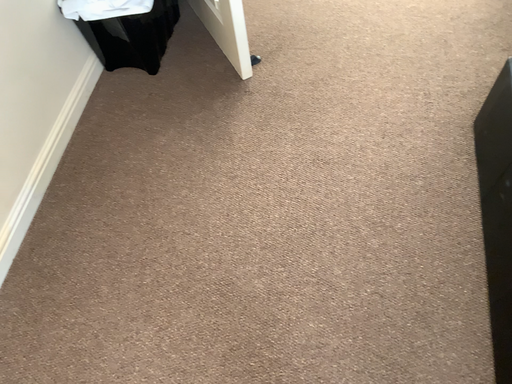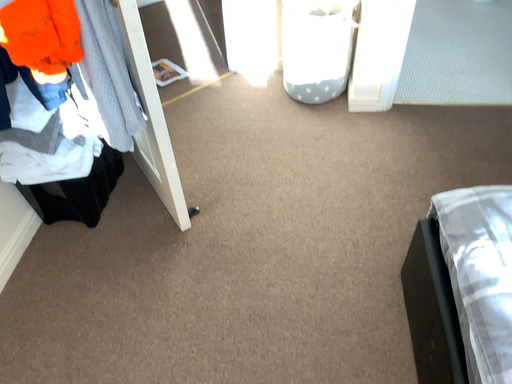
Question: Which way did the camera rotate in the video?

Choices:
 (A) rotated upward
 (B) rotated downward

Answer: (A)